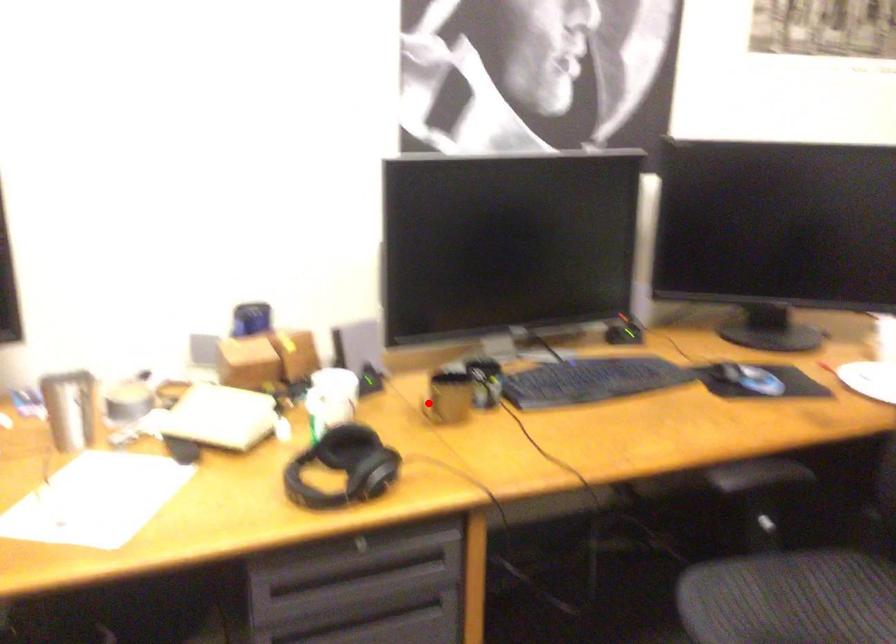
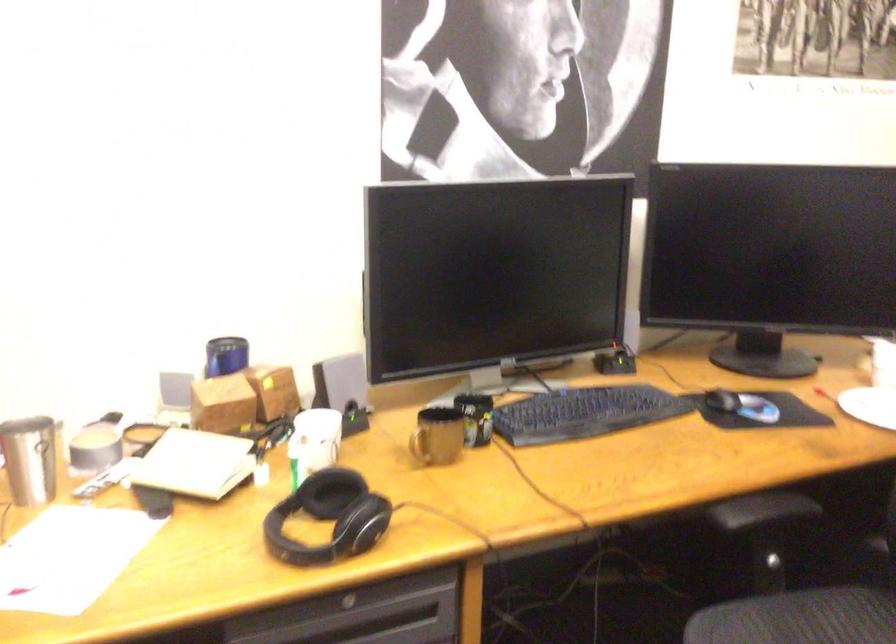
Locate, in the second image, the point that corresponds to the highlighted location in the first image.

(419, 442)